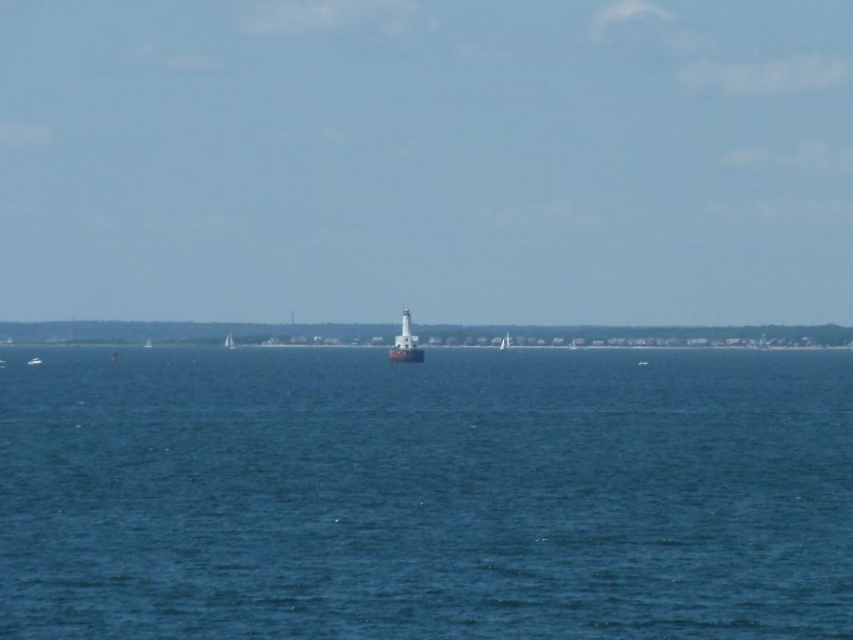
You are a photographer planning to take a landscape photo of the white matte lighthouse at center and the white matte sailboat at center. Which object will appear larger in the photo?

The white matte lighthouse at center will appear larger in the photo because it is much taller than the white matte sailboat at center.

You are standing on the deck of the white matte sailboat at center and want to get a drink of water. There is a water bottle on the blue water at center. Can you reach it without leaving the boat?

The blue water at center is closer to the viewer than the white matte sailboat at center, so the water bottle on the blue water at center is actually closer to you. You can reach it without leaving the boat.

You are a photographer positioned at the camera location. You want to take a photo that includes both the point at coordinates point(650, 385) and point(228, 344). Which point will appear larger in the photo?

Point(650, 385) is closer to the camera than point(228, 344), so it will appear larger in the photo.